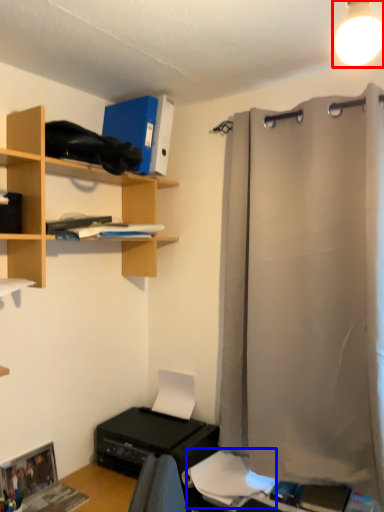
Question: Which object appears closest to the camera in this image, light fixture (highlighted by a red box) or sheet (highlighted by a blue box)?

Choices:
 (A) light fixture
 (B) sheet

Answer: (A)